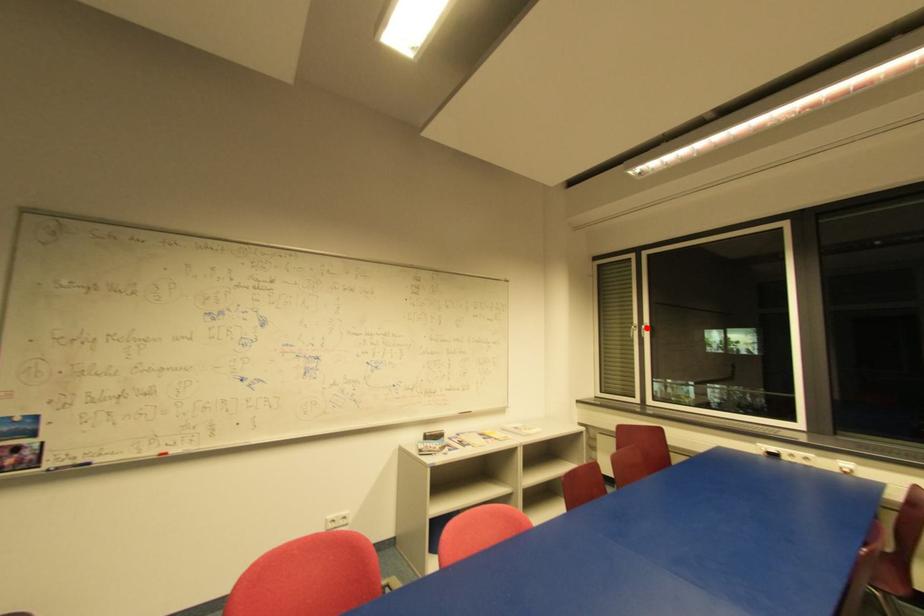
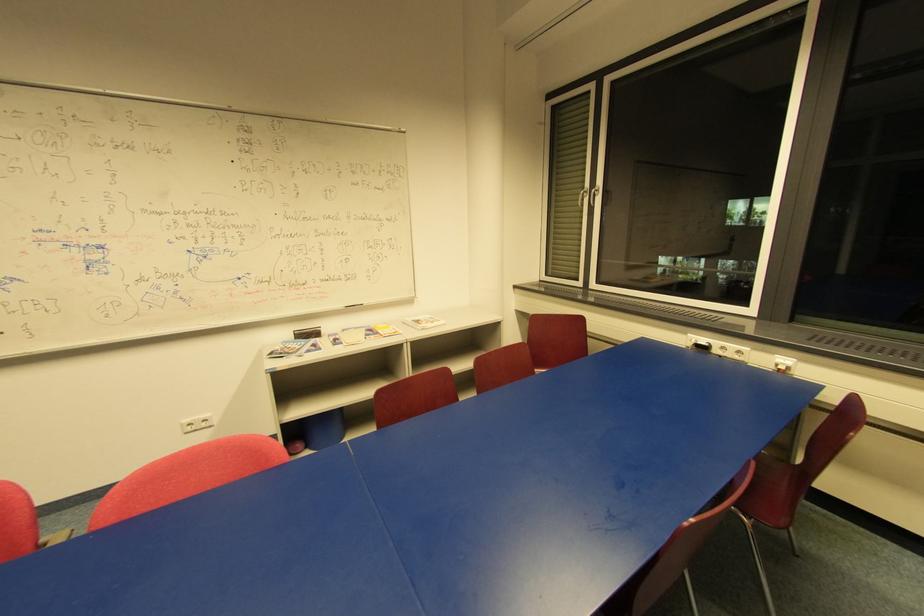
In the second image, find the point that corresponds to the highlighted location in the first image.

(598, 192)